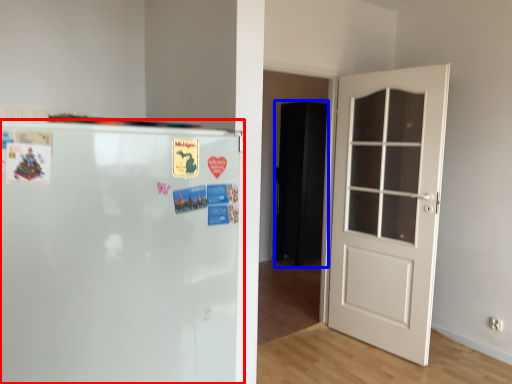
Question: Among these objects, which one is nearest to the camera, refrigerator (highlighted by a red box) or armoire (highlighted by a blue box)?

Choices:
 (A) refrigerator
 (B) armoire

Answer: (A)